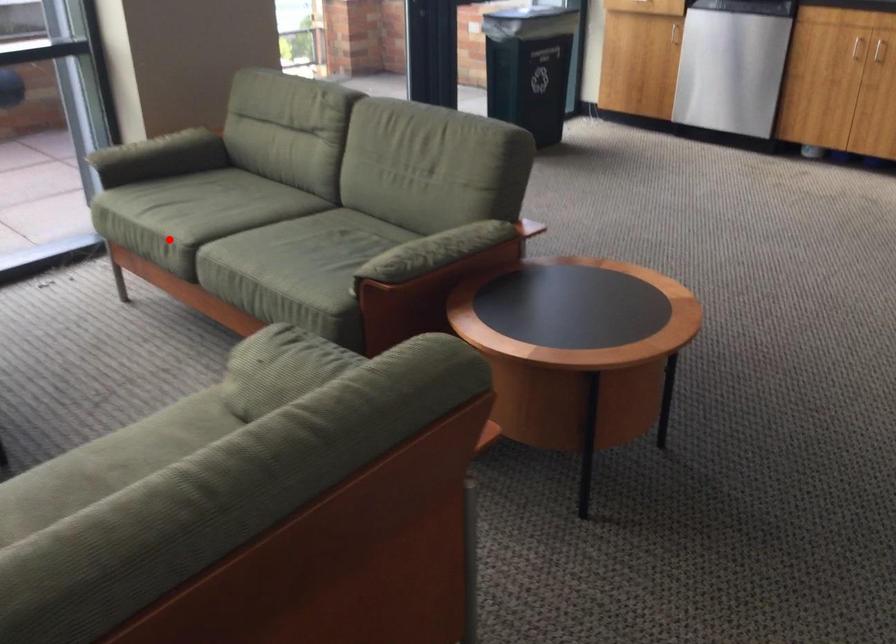
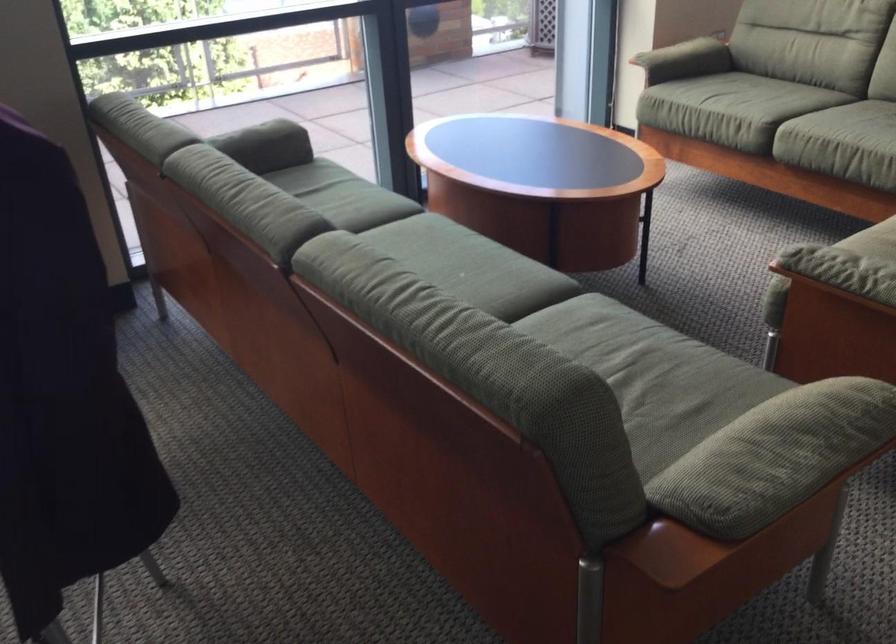
Question: A red point is marked in image1. In image2, is the corresponding 3D point closer to the camera or farther? Reply with the corresponding letter.

Choices:
 (A) The corresponding 3D point is closer.
 (B) The corresponding 3D point is farther.

Answer: (B)